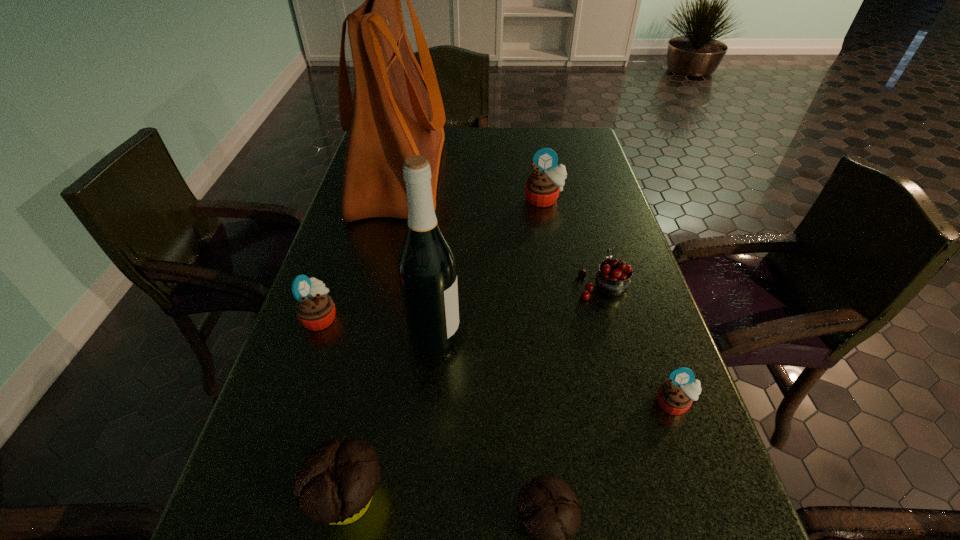
Image resolution: width=960 pixels, height=540 pixels. What are the coordinates of `shopping bag positioned at the left edge` in the screenshot? It's located at (396, 112).

Where is `muffin that is at the left edge`? muffin that is at the left edge is located at coordinates (315, 310).

This screenshot has height=540, width=960. I want to click on cherry that is at the right edge, so click(x=613, y=279).

Locate an element on the screen. This screenshot has height=540, width=960. object present at the far left corner is located at coordinates (396, 112).

You are a GUI agent. You are given a task and a screenshot of the screen. Output one action in this format:
    pyautogui.click(x=<x>, y=<y>)
    Task: Click on the vacant space at the far edge of the desktop
    This screenshot has width=960, height=540.
    Given the screenshot: What is the action you would take?
    pyautogui.click(x=504, y=148)

Where is `vacant space at the left edge of the desktop`? This screenshot has height=540, width=960. vacant space at the left edge of the desktop is located at coordinates (362, 324).

Image resolution: width=960 pixels, height=540 pixels. In order to click on blank space at the right edge of the desktop in this screenshot , I will do `click(652, 422)`.

The image size is (960, 540). Identify the location of free region at the far right corner of the desktop. (586, 141).

Image resolution: width=960 pixels, height=540 pixels. I want to click on unoccupied position between the farthest muffin and the third farthest muffin, so click(x=609, y=301).

At what (x,y) coordinates should I click in order to perform the action: click on unoccupied area between the farthest muffin and the cherry. Please return your answer as a coordinate pair (x, y). Looking at the image, I should click on (573, 242).